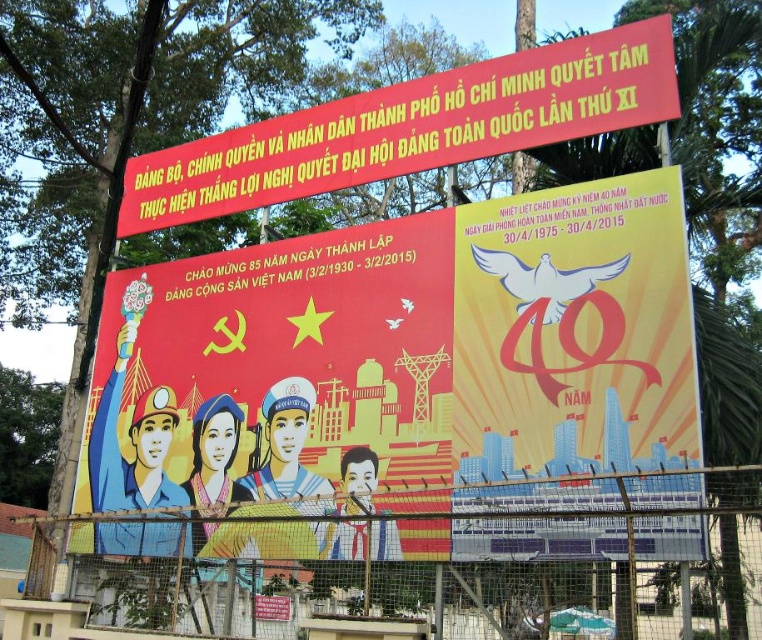
You are an engineer inspecting the billboard. You need to locate the metal wire mesh at lower center. What are its coordinates?

The metal wire mesh at lower center is located at coordinates point (399, 593).

You are a pedestrian walking on the street and see the billboard. Which object, the matte red poster at center or the red banner at upper center, is located higher up on the billboard?

The red banner at upper center is located higher up on the billboard than the matte red poster at center.